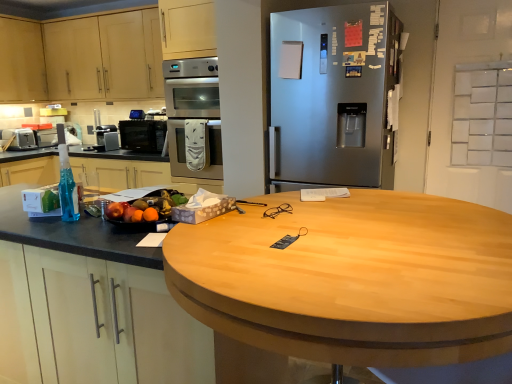
Question: Is matte wood cabinet at upper left, the 2th cabinetry viewed from the right, looking in the opposite direction of wooden at left?

Choices:
 (A) yes
 (B) no

Answer: (B)

Question: Can you confirm if matte wood cabinet at upper left, the 2th cabinetry viewed from the right, is positioned to the right of wooden at left?

Choices:
 (A) no
 (B) yes

Answer: (A)

Question: Considering the relative sizes of matte wood cabinet at upper left, the 2th cabinetry viewed from the right, and wooden at left in the image provided, is matte wood cabinet at upper left, the 2th cabinetry viewed from the right, taller than wooden at left?

Choices:
 (A) no
 (B) yes

Answer: (A)

Question: Is matte wood cabinet at upper left, which is counted as the first cabinetry, starting from the left, further to camera compared to wooden at left?

Choices:
 (A) no
 (B) yes

Answer: (B)

Question: Could wooden at left be considered to be inside matte wood cabinet at upper left, which is counted as the first cabinetry, starting from the left?

Choices:
 (A) yes
 (B) no

Answer: (B)

Question: Considering the relative sizes of matte wood cabinet at upper left, the 2th cabinetry viewed from the right, and wooden at left in the image provided, is matte wood cabinet at upper left, the 2th cabinetry viewed from the right, smaller than wooden at left?

Choices:
 (A) no
 (B) yes

Answer: (B)

Question: Can you confirm if translucent blue liquid at left is bigger than satin silver oven at center?

Choices:
 (A) yes
 (B) no

Answer: (B)

Question: Is satin silver oven at center completely or partially inside translucent blue liquid at left?

Choices:
 (A) no
 (B) yes

Answer: (A)

Question: Is the depth of translucent blue liquid at left less than that of satin silver oven at center?

Choices:
 (A) yes
 (B) no

Answer: (A)

Question: Is translucent blue liquid at left oriented towards satin silver oven at center?

Choices:
 (A) no
 (B) yes

Answer: (A)

Question: Does translucent blue liquid at left have a greater width compared to satin silver oven at center?

Choices:
 (A) no
 (B) yes

Answer: (A)

Question: From a real-world perspective, is translucent blue liquid at left physically below satin silver oven at center?

Choices:
 (A) yes
 (B) no

Answer: (A)

Question: Is translucent blue liquid at left with glossy plastic fruit bowl at left?

Choices:
 (A) no
 (B) yes

Answer: (A)